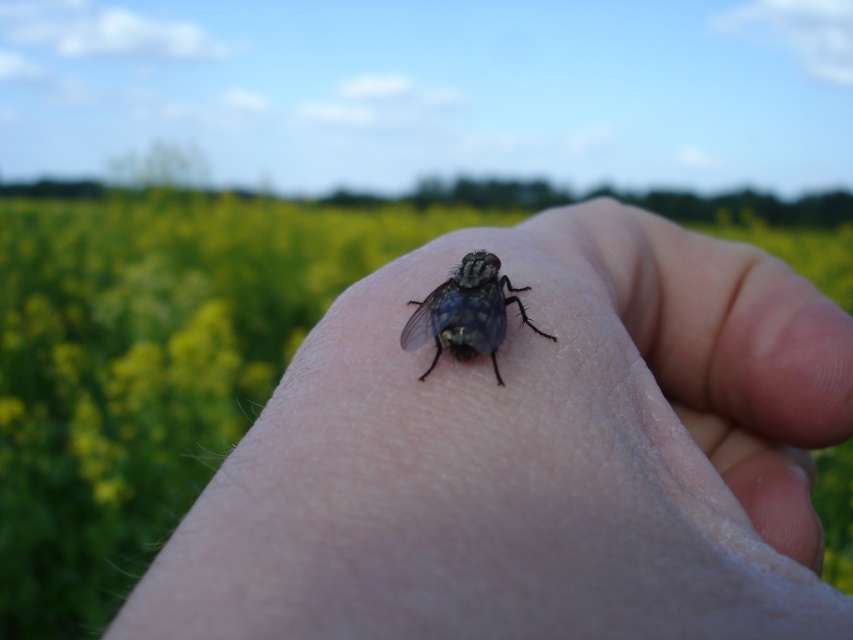
You are a photographer trying to capture the shiny metallic fly at center on the smooth skin hand at center. If you want to ensure the fly is clearly visible, which object should be closer to the camera lens?

The shiny metallic fly at center should be closer to the camera lens because the smooth skin hand at center is taller than the shiny metallic fly at center, making the fly smaller in comparison and thus requiring closer positioning for clarity.

You are a photographer trying to focus on two points in the image. The first point is point (x=495, y=477) and the second is point (x=409, y=323). Which point is closer to you?

Point (x=495, y=477) is closer to the viewer than point (x=409, y=323).

You are a photographer trying to capture a closeup of the shiny metallic fly at center. You notice the smooth skin hand at center in the foreground. Will the hand block the view of the fly in your photo?

The smooth skin hand at center is closer to the viewer than the shiny metallic fly at center, so the hand will block the view of the fly in your photo.